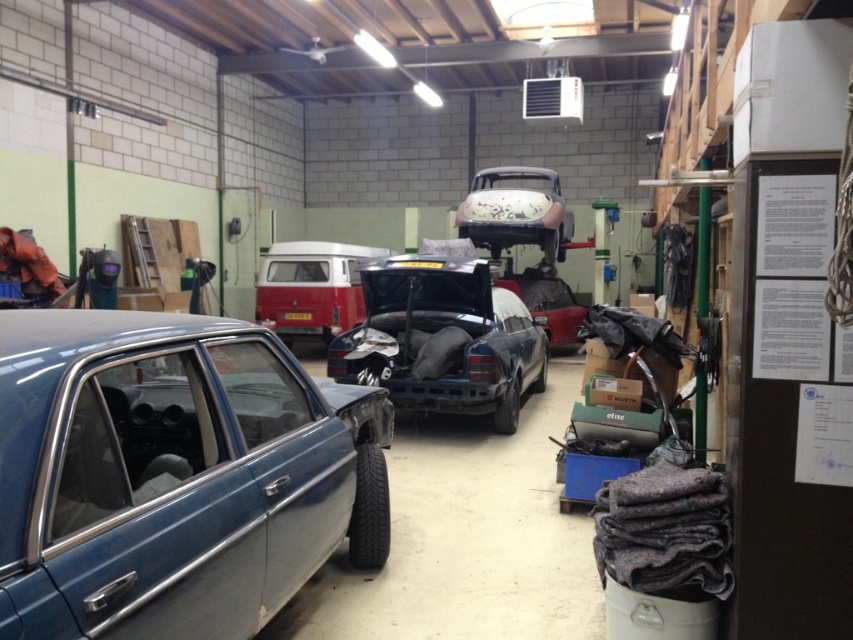
Question: Is matte white van at center to the right of metallic silver car at center from the viewer's perspective?

Choices:
 (A) no
 (B) yes

Answer: (A)

Question: Can you confirm if rusty metal car at center is thinner than rusty metallic car at center?

Choices:
 (A) yes
 (B) no

Answer: (B)

Question: Among these points, which one is farthest from the camera?

Choices:
 (A) (305, 292)
 (B) (523, 289)
 (C) (473, 284)
 (D) (566, 214)

Answer: (B)

Question: Which of the following is the closest to the observer?

Choices:
 (A) metallic silver car at center
 (B) metallic blue car at lower left
 (C) rusty metal car at center

Answer: (B)

Question: Which of the following is the farthest from the observer?

Choices:
 (A) rusty metal car at center
 (B) rusty metallic car at center
 (C) matte white van at center

Answer: (C)

Question: Is metallic blue car at lower left behind rusty metallic car at center?

Choices:
 (A) yes
 (B) no

Answer: (B)